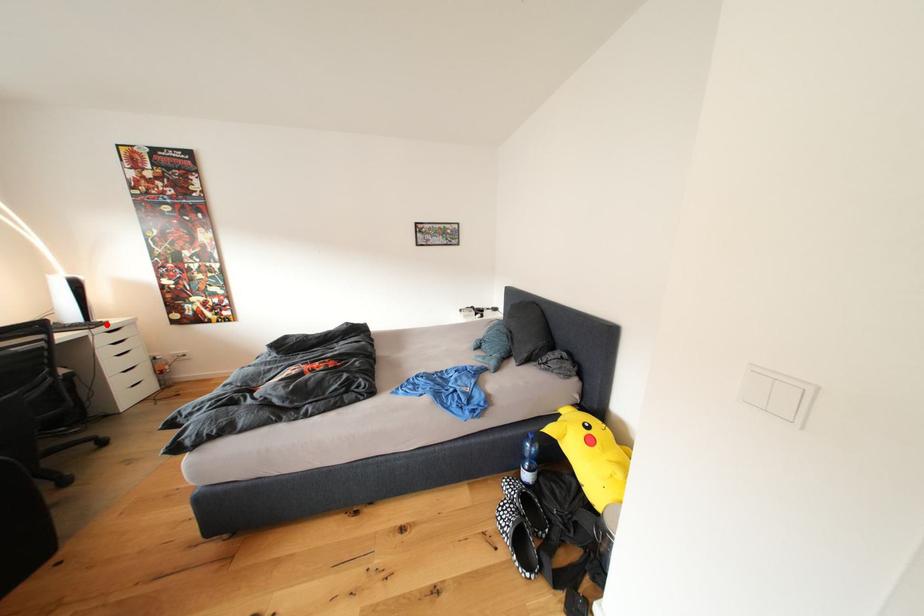
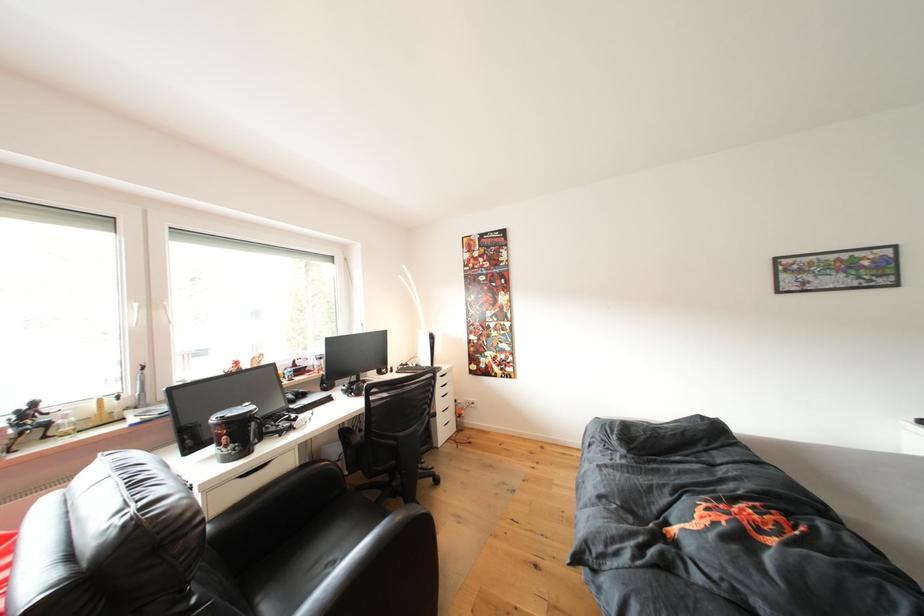
The point at the highlighted location is marked in the first image. Where is the corresponding point in the second image?

(444, 370)